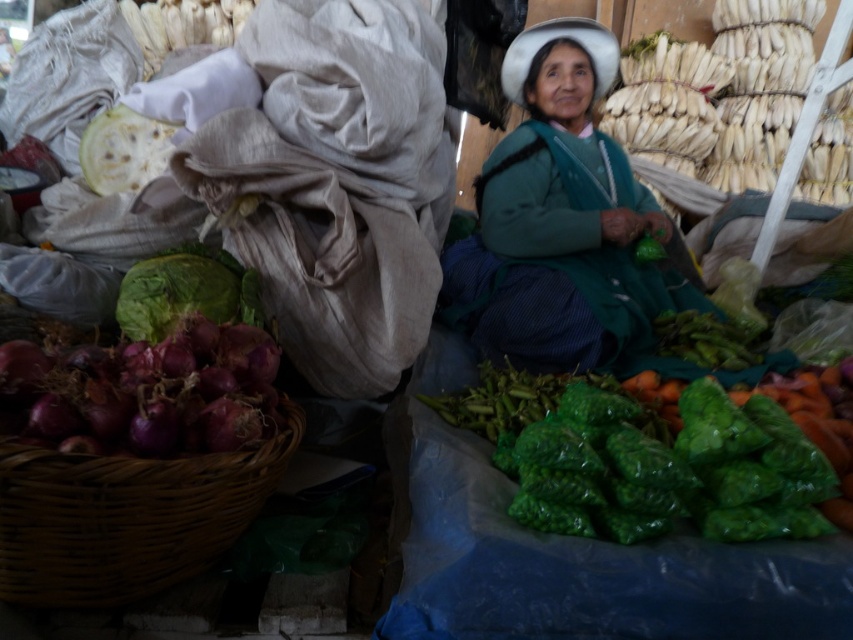
Is purple matte onion at lower left to the right of white flour tortilla at upper left from the viewer's perspective?

Yes, purple matte onion at lower left is to the right of white flour tortilla at upper left.

Which is in front, point (115, 438) or point (115, 109)?

Point (115, 438)

Find the location of a particular element. This screenshot has height=640, width=853. purple matte onion at lower left is located at coordinates (144, 392).

Locate an element on the screen. The image size is (853, 640). purple matte onion at lower left is located at coordinates (144, 392).

Where is `white flour tortilla at upper left`? white flour tortilla at upper left is located at coordinates click(x=123, y=150).

Who is positioned more to the right, white flour tortilla at upper left or green leafy at center?

From the viewer's perspective, green leafy at center appears more on the right side.

Who is more forward, (126, 168) or (654, 232)?

Point (126, 168) is in front.

Where is `white flour tortilla at upper left`? white flour tortilla at upper left is located at coordinates (123, 150).

Can you confirm if green fabric at center is positioned below brown wicker basket at lower left?

No, green fabric at center is not below brown wicker basket at lower left.

Who is taller, green fabric at center or brown wicker basket at lower left?

green fabric at center is taller.

Who is more distant from viewer, (686,307) or (64,557)?

Point (686,307)

Where is `green fabric at center`? Image resolution: width=853 pixels, height=640 pixels. green fabric at center is located at coordinates (560, 220).